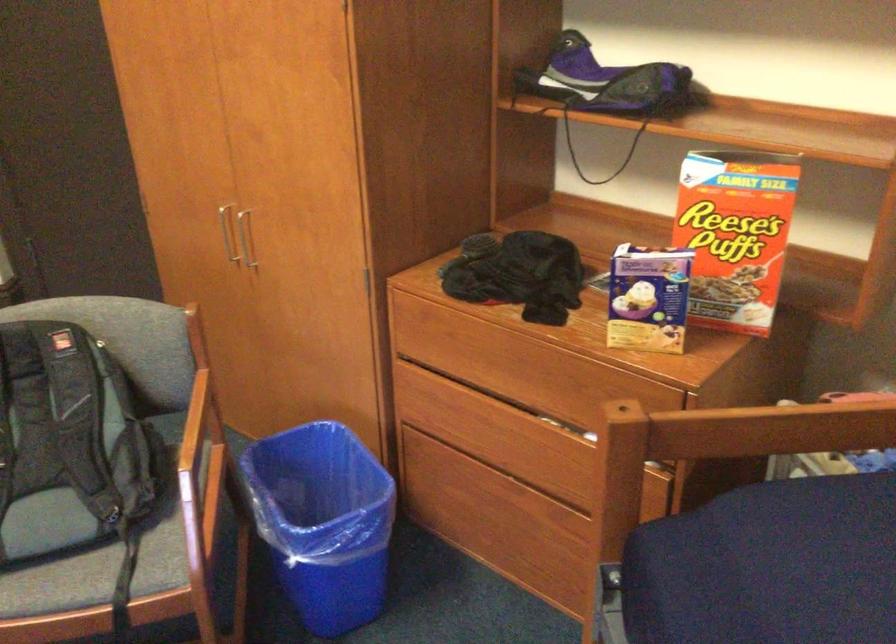
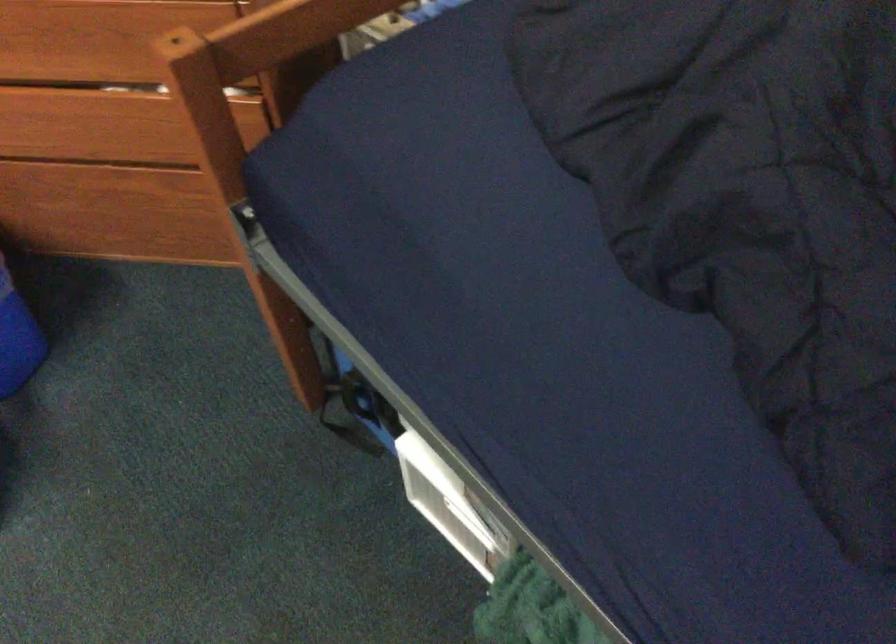
How did the camera likely rotate?

The camera's rotation is toward right-down.